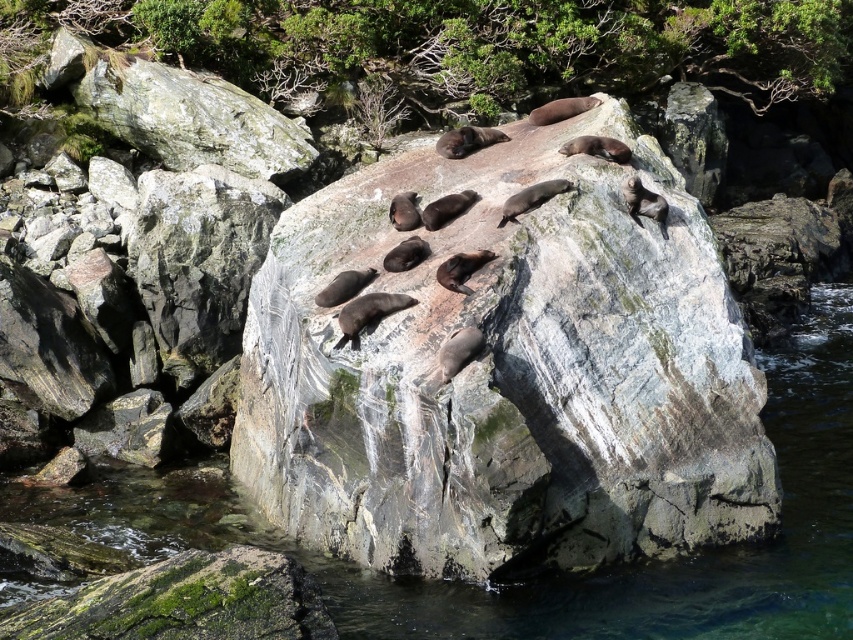
You are a photographer positioned at the center of the image. You want to capture a closeup of the smooth gray rock at center. Which direction should you move to get closer to the rock?

Since the smooth gray rock at center is located at coordinates approximately 0.586 on the x and y axis, which is near the center of the image, you are already positioned close to the rock. Moving towards the center would not change your position significantly. However, if you need to get closer, you might need to adjust your camera zoom instead of moving physically.

You are a marine biologist observing the coastal scene. You need to place a 3m wide research buoy between the smooth gray rock at center and the clear water at rock center. Can the space between them accommodate the buoy?

The smooth gray rock at center is narrower than the clear water at rock center. However, the description only provides information about their widths relative to each other, not their absolute measurements. Without knowing the exact width of either object, it is impossible to determine if the 3m wide research buoy can fit between them.